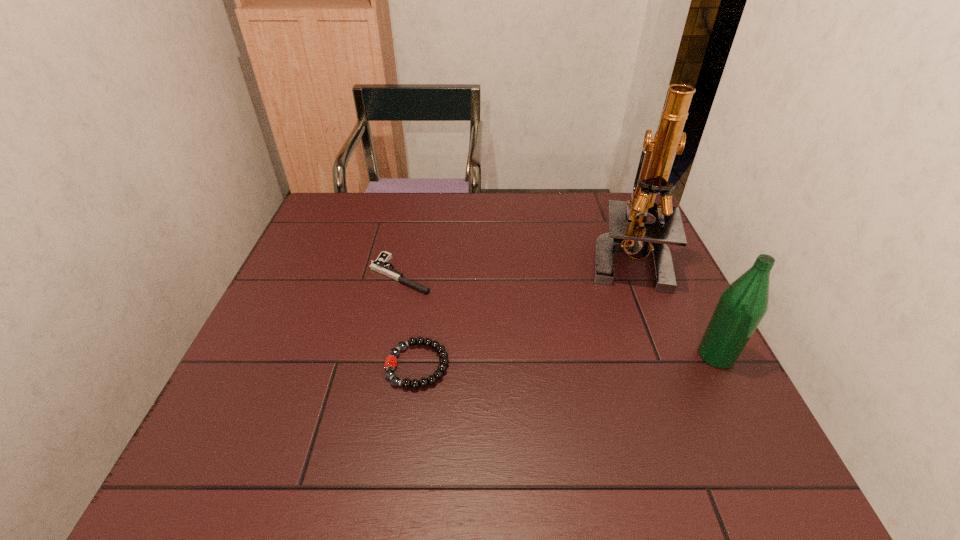
You are a GUI agent. You are given a task and a screenshot of the screen. Output one action in this format:
    pyautogui.click(x=<x>, y=<y>)
    Task: Click on the vacant space located 0.210m on the front-facing side of the shortest object
    The height and width of the screenshot is (540, 960).
    Given the screenshot: What is the action you would take?
    pyautogui.click(x=495, y=315)

You are a GUI agent. You are given a task and a screenshot of the screen. Output one action in this format:
    pyautogui.click(x=<x>, y=<y>)
    Task: Click on the vacant region located 0.370m on the front-facing side of the shortest object
    
    Given the screenshot: What is the action you would take?
    pyautogui.click(x=556, y=342)

This screenshot has width=960, height=540. I want to click on object that is at the far edge, so click(628, 231).

Locate an element on the screen. The image size is (960, 540). bottle that is at the right edge is located at coordinates (742, 305).

Identify the location of microscope located in the right edge section of the desktop. The height and width of the screenshot is (540, 960). (628, 231).

Locate an element on the screen. The image size is (960, 540). object positioned at the far right corner is located at coordinates (628, 231).

What are the coordinates of `free region at the far edge of the desktop` in the screenshot? It's located at (570, 203).

Where is `vacant space at the near edge of the desktop`? vacant space at the near edge of the desktop is located at coordinates tap(596, 419).

In the image, there is a desktop. Identify the location of free space at the left edge. (295, 298).

You are a GUI agent. You are given a task and a screenshot of the screen. Output one action in this format:
    pyautogui.click(x=<x>, y=<y>)
    Task: Click on the free region at the right edge of the desktop
    
    Given the screenshot: What is the action you would take?
    pyautogui.click(x=647, y=312)